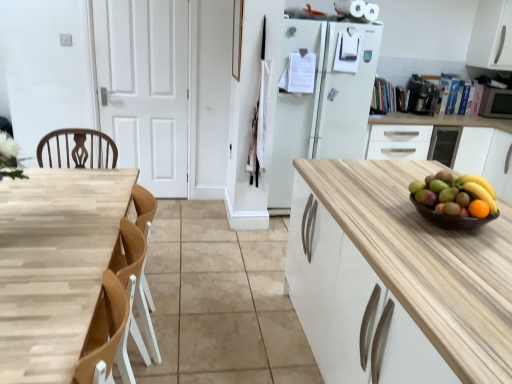
Where is `white matte door at center`? The width and height of the screenshot is (512, 384). white matte door at center is located at coordinates click(145, 88).

What do you see at coordinates (451, 218) in the screenshot?
I see `matte brown bowl at right` at bounding box center [451, 218].

What is the approximate height of black plastic coffee maker at upper right, marked as the 2th appliance in a right-to-left arrangement?

black plastic coffee maker at upper right, marked as the 2th appliance in a right-to-left arrangement, is 14.32 inches in height.

The height and width of the screenshot is (384, 512). What do you see at coordinates (422, 96) in the screenshot? I see `black plastic coffee maker at upper right, marked as the 2th appliance in a right-to-left arrangement` at bounding box center [422, 96].

In order to face white matte cabinet at right, the 2th cabinetry in the top-to-bottom sequence, should I rotate leftwards or rightwards?

Turn right by 27.447 degrees to look at white matte cabinet at right, the 2th cabinetry in the top-to-bottom sequence.

What do you see at coordinates (492, 36) in the screenshot? I see `white matte cabinet at upper right, acting as the first cabinetry starting from the top` at bounding box center [492, 36].

At what (x,y) coordinates should I click in order to perform the action: click on white matte door at center. Please return your answer as a coordinate pair (x, y). Looking at the image, I should click on (145, 88).

Is white matte cabinet at right, acting as the first cabinetry starting from the bottom, positioned far away from matte brown bowl at right?

Absolutely, white matte cabinet at right, acting as the first cabinetry starting from the bottom, is distant from matte brown bowl at right.

In the scene shown: From a real-world perspective, is white matte cabinet at right, acting as the first cabinetry starting from the bottom, positioned above or below matte brown bowl at right?

In terms of real-world spatial position, white matte cabinet at right, acting as the first cabinetry starting from the bottom, is below matte brown bowl at right.

Does point (461, 163) come behind point (474, 225)?

Yes, point (461, 163) is behind point (474, 225).

In the scene shown: Can you confirm if metallic silver microwave at right, placed as the 2th appliance when sorted from left to right, is positioned to the left of white matte cabinet at upper right, the second cabinetry from the bottom?

In fact, metallic silver microwave at right, placed as the 2th appliance when sorted from left to right, is to the right of white matte cabinet at upper right, the second cabinetry from the bottom.

Looking at their sizes, would you say metallic silver microwave at right, placed as the 1th appliance when sorted from right to left, is wider or thinner than white matte cabinet at upper right, the second cabinetry from the bottom?

metallic silver microwave at right, placed as the 1th appliance when sorted from right to left, is thinner than white matte cabinet at upper right, the second cabinetry from the bottom.

From the image's perspective, is metallic silver microwave at right, placed as the 1th appliance when sorted from right to left, located above white matte cabinet at upper right, acting as the first cabinetry starting from the top?

Incorrect, from the image's perspective, metallic silver microwave at right, placed as the 1th appliance when sorted from right to left, is lower than white matte cabinet at upper right, acting as the first cabinetry starting from the top.

Based on the photo, would you say metallic silver microwave at right, placed as the 1th appliance when sorted from right to left, is outside white matte cabinet at upper right, the second cabinetry from the bottom?

Absolutely, metallic silver microwave at right, placed as the 1th appliance when sorted from right to left, is external to white matte cabinet at upper right, the second cabinetry from the bottom.

Is black plastic coffee maker at upper right, marked as the 2th appliance in a right-to-left arrangement, positioned far away from matte brown bowl at right?

Yes, black plastic coffee maker at upper right, marked as the 2th appliance in a right-to-left arrangement, and matte brown bowl at right are quite far apart.

From a real-world perspective, between black plastic coffee maker at upper right, marked as the 2th appliance in a right-to-left arrangement, and matte brown bowl at right, who is vertically higher?

black plastic coffee maker at upper right, marked as the 2th appliance in a right-to-left arrangement, is physically above.

Between black plastic coffee maker at upper right, the first appliance in the left-to-right sequence, and matte brown bowl at right, which one has smaller size?

With smaller size is matte brown bowl at right.

Is point (430, 82) positioned in front of point (418, 203)?

That is False.

Considering the relative sizes of matte brown bowl at right and orange matte grapefruit at right in the image provided, is matte brown bowl at right wider than orange matte grapefruit at right?

Yes, matte brown bowl at right is wider than orange matte grapefruit at right.

Can you see matte brown bowl at right touching orange matte grapefruit at right?

matte brown bowl at right and orange matte grapefruit at right are clearly separated.

Could you tell me if matte brown bowl at right is facing orange matte grapefruit at right?

No, matte brown bowl at right is not aimed at orange matte grapefruit at right.

At what (x,y) coordinates should I click in order to perform the action: click on grapefruit that is in front of the matte brown bowl at right. Please return your answer as a coordinate pair (x, y). Looking at the image, I should click on (456, 194).

Can you tell me how much orange matte grapefruit at right and white matte door at center differ in facing direction?

91.6 degrees.

Is point (464, 182) closer or farther from the camera than point (155, 166)?

Point (464, 182) is positioned closer to the camera compared to point (155, 166).

Consider the image. From a real-world perspective, which object stands above the other?

orange matte grapefruit at right.

Is orange matte grapefruit at right inside the boundaries of white matte door at center, or outside?

orange matte grapefruit at right is not inside white matte door at center, it's outside.

Is black plastic coffee maker at upper right, marked as the 2th appliance in a right-to-left arrangement, far away from white matte cabinet at upper right, acting as the first cabinetry starting from the top?

No, black plastic coffee maker at upper right, marked as the 2th appliance in a right-to-left arrangement, is in close proximity to white matte cabinet at upper right, acting as the first cabinetry starting from the top.

From a real-world perspective, which is physically above, black plastic coffee maker at upper right, the first appliance in the left-to-right sequence, or white matte cabinet at upper right, acting as the first cabinetry starting from the top?

white matte cabinet at upper right, acting as the first cabinetry starting from the top, from a real-world perspective.

Considering the sizes of objects black plastic coffee maker at upper right, marked as the 2th appliance in a right-to-left arrangement, and white matte cabinet at upper right, the second cabinetry from the bottom, in the image provided, who is thinner, black plastic coffee maker at upper right, marked as the 2th appliance in a right-to-left arrangement, or white matte cabinet at upper right, the second cabinetry from the bottom,?

With smaller width is black plastic coffee maker at upper right, marked as the 2th appliance in a right-to-left arrangement.

Image resolution: width=512 pixels, height=384 pixels. In order to click on the 1st appliance behind the white matte cabinet at upper right, acting as the first cabinetry starting from the top in this screenshot , I will do `click(422, 96)`.

Which of these two, matte brown bowl at right or black plastic coffee maker at upper right, the first appliance in the left-to-right sequence, stands taller?

With more height is black plastic coffee maker at upper right, the first appliance in the left-to-right sequence.

Is matte brown bowl at right aimed at black plastic coffee maker at upper right, marked as the 2th appliance in a right-to-left arrangement?

No.

Is matte brown bowl at right to the left of black plastic coffee maker at upper right, marked as the 2th appliance in a right-to-left arrangement, from the viewer's perspective?

Correct, you'll find matte brown bowl at right to the left of black plastic coffee maker at upper right, marked as the 2th appliance in a right-to-left arrangement.

The height and width of the screenshot is (384, 512). Find the location of `glass bowl located on the left of white matte cabinet at right, the 2th cabinetry in the top-to-bottom sequence`. glass bowl located on the left of white matte cabinet at right, the 2th cabinetry in the top-to-bottom sequence is located at coordinates (451, 218).

Identify the location of the 2nd appliance behind the white matte cabinet at upper right, the second cabinetry from the bottom, counting from the anchor's position. (496, 103).

From the image, which object appears to be farther from white matte cabinet at right, acting as the first cabinetry starting from the bottom, metallic silver microwave at right, placed as the 2th appliance when sorted from left to right, or orange matte grapefruit at right?

orange matte grapefruit at right lies further to white matte cabinet at right, acting as the first cabinetry starting from the bottom, than the other object.

Based on the photo, from the image, which object appears to be farther from orange matte grapefruit at right, matte brown bowl at right or white matte cabinet at upper right, acting as the first cabinetry starting from the top?

Based on the image, white matte cabinet at upper right, acting as the first cabinetry starting from the top, appears to be further to orange matte grapefruit at right.

When comparing their distances from orange matte grapefruit at right, does black plastic coffee maker at upper right, the first appliance in the left-to-right sequence, or white matte cabinet at upper right, acting as the first cabinetry starting from the top, seem closer?

black plastic coffee maker at upper right, the first appliance in the left-to-right sequence, is positioned closer to the anchor orange matte grapefruit at right.

Based on their spatial positions, is light wood table at left or black plastic coffee maker at upper right, marked as the 2th appliance in a right-to-left arrangement, closer to orange matte grapefruit at right?

light wood table at left is closer to orange matte grapefruit at right.

Estimate the real-world distances between objects in this image. Which object is closer to white matte cabinet at right, the 2th cabinetry in the top-to-bottom sequence, white matte door at center or light wood table at left?

Based on the image, white matte door at center appears to be nearer to white matte cabinet at right, the 2th cabinetry in the top-to-bottom sequence.

Considering their positions, is metallic silver microwave at right, placed as the 1th appliance when sorted from right to left, positioned further to black plastic coffee maker at upper right, marked as the 2th appliance in a right-to-left arrangement, than white matte cabinet at right, the 2th cabinetry in the top-to-bottom sequence?

metallic silver microwave at right, placed as the 1th appliance when sorted from right to left.

Estimate the real-world distances between objects in this image. Which object is further from black plastic coffee maker at upper right, marked as the 2th appliance in a right-to-left arrangement, light wood table at left or matte brown bowl at right?

Among the two, light wood table at left is located further to black plastic coffee maker at upper right, marked as the 2th appliance in a right-to-left arrangement.

From the image, which object appears to be farther from white matte cabinet at upper right, the second cabinetry from the bottom, orange matte grapefruit at right or white matte door at center?

white matte door at center is further to white matte cabinet at upper right, the second cabinetry from the bottom.

You are a GUI agent. You are given a task and a screenshot of the screen. Output one action in this format:
    pyautogui.click(x=<x>, y=<y>)
    Task: Click on the grapefruit between light wood table at left and white matte cabinet at right, the 2th cabinetry in the top-to-bottom sequence
    This screenshot has height=384, width=512.
    Given the screenshot: What is the action you would take?
    pyautogui.click(x=456, y=194)

What are the coordinates of `glass bowl between orange matte grapefruit at right and white matte cabinet at right, the 2th cabinetry in the top-to-bottom sequence, from front to back` in the screenshot? It's located at (451, 218).

Locate an element on the screen. The width and height of the screenshot is (512, 384). grapefruit located between light wood table at left and white matte cabinet at upper right, the second cabinetry from the bottom, in the left-right direction is located at coordinates (456, 194).

This screenshot has width=512, height=384. I want to click on glass bowl between white matte door at center and white matte cabinet at right, the 2th cabinetry in the top-to-bottom sequence, from left to right, so click(451, 218).